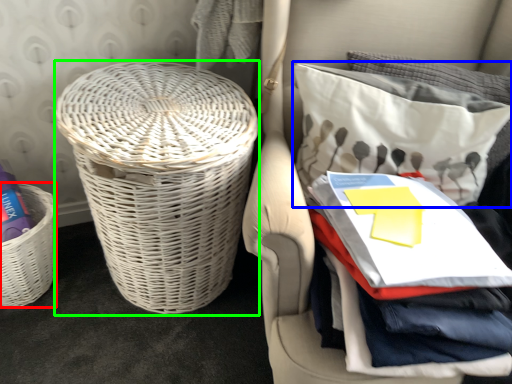
Question: Estimate the real-world distances between objects in this image. Which object is closer to basket (highlighted by a red box), pillow (highlighted by a blue box) or basket (highlighted by a green box)?

Choices:
 (A) pillow
 (B) basket

Answer: (B)